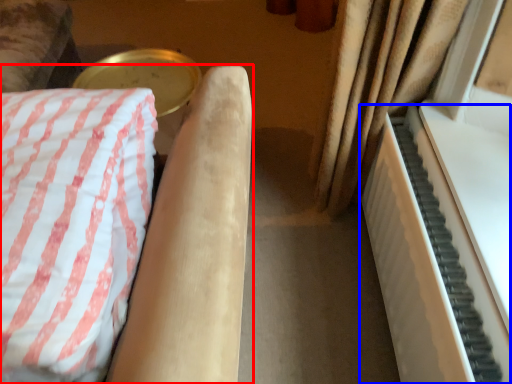
Question: Which object appears farthest to the camera in this image, furniture (highlighted by a red box) or piano (highlighted by a blue box)?

Choices:
 (A) furniture
 (B) piano

Answer: (B)